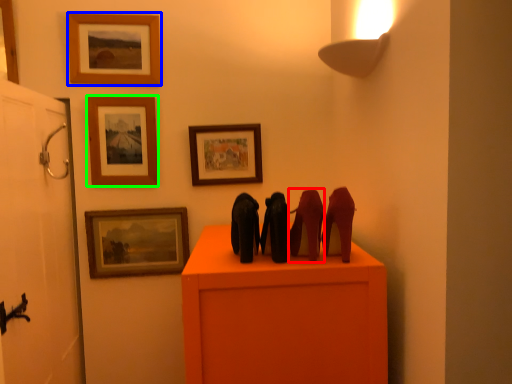
Question: Estimate the real-world distances between objects in this image. Which object is farther from animal (highlighted by a red box), picture frame (highlighted by a blue box) or picture frame (highlighted by a green box)?

Choices:
 (A) picture frame
 (B) picture frame

Answer: (A)